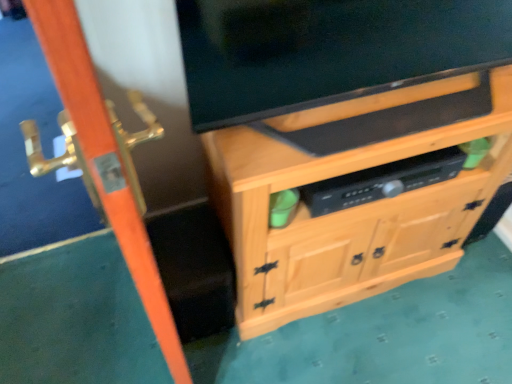
Question: Is matte black tv at upper center smaller than orange wood screen door at left?

Choices:
 (A) yes
 (B) no

Answer: (A)

Question: Considering the relative sizes of matte black tv at upper center and orange wood screen door at left in the image provided, is matte black tv at upper center shorter than orange wood screen door at left?

Choices:
 (A) no
 (B) yes

Answer: (B)

Question: Is matte black tv at upper center looking in the opposite direction of orange wood screen door at left?

Choices:
 (A) no
 (B) yes

Answer: (A)

Question: Can we say matte black tv at upper center lies outside orange wood screen door at left?

Choices:
 (A) yes
 (B) no

Answer: (A)

Question: Does matte black tv at upper center come behind orange wood screen door at left?

Choices:
 (A) yes
 (B) no

Answer: (A)

Question: Considering their positions, is matte black tv at upper center located in front of or behind orange wood screen door at left?

Choices:
 (A) front
 (B) behind

Answer: (B)

Question: From the image's perspective, is matte black tv at upper center above or below orange wood screen door at left?

Choices:
 (A) above
 (B) below

Answer: (A)

Question: Is matte black tv at upper center to the left or to the right of orange wood screen door at left in the image?

Choices:
 (A) right
 (B) left

Answer: (A)

Question: Is matte black tv at upper center inside the boundaries of orange wood screen door at left, or outside?

Choices:
 (A) outside
 (B) inside

Answer: (A)

Question: In the image, is orange wood screen door at left on the left side or the right side of matte black tv at upper center?

Choices:
 (A) left
 (B) right

Answer: (A)

Question: From a real-world perspective, is orange wood screen door at left positioned above or below matte black tv at upper center?

Choices:
 (A) below
 (B) above

Answer: (A)

Question: Is point (84, 56) positioned closer to the camera than point (274, 69)?

Choices:
 (A) farther
 (B) closer

Answer: (B)

Question: Is orange wood screen door at left spatially inside matte black tv at upper center, or outside of it?

Choices:
 (A) inside
 (B) outside

Answer: (B)

Question: Is natural wood cabinet at center bigger or smaller than matte black tv at upper center?

Choices:
 (A) big
 (B) small

Answer: (A)

Question: Is point (268, 312) positioned closer to the camera than point (242, 24)?

Choices:
 (A) farther
 (B) closer

Answer: (A)